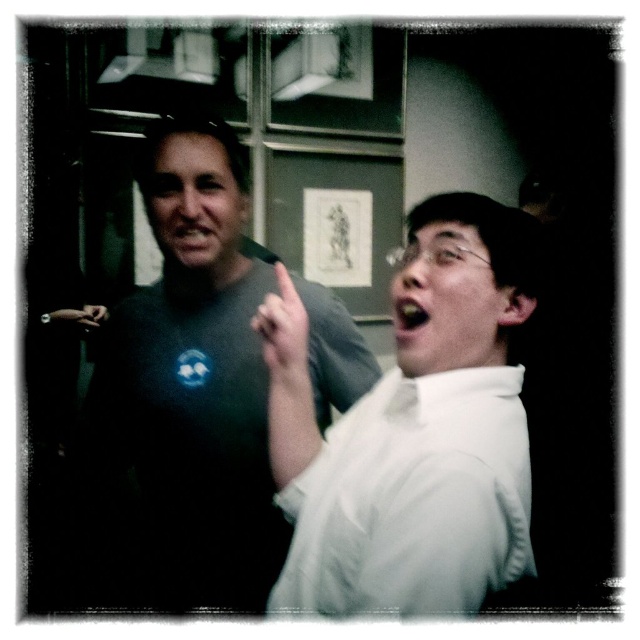
Which is below, white cotton shirt at right or smooth yellowish mouth at center?

Positioned lower is white cotton shirt at right.

Between white cotton shirt at right and smooth yellowish mouth at center, which one appears on the right side from the viewer's perspective?

smooth yellowish mouth at center is more to the right.

Is point (403, 516) farther from viewer compared to point (404, 330)?

No, (403, 516) is closer to viewer.

Locate an element on the screen. The height and width of the screenshot is (640, 640). white cotton shirt at right is located at coordinates (412, 500).

Which is in front, point (396, 429) or point (83, 320)?

Point (396, 429)

Does white cotton shirt at right lie behind matte black hand at upper left?

No, it is in front of matte black hand at upper left.

Which is in front, point (440, 428) or point (80, 321)?

Positioned in front is point (440, 428).

Identify the location of white cotton shirt at right. This screenshot has width=640, height=640. (412, 500).

This screenshot has width=640, height=640. In order to click on dark gray t-shirt at upper left in this screenshot , I will do `click(193, 376)`.

Which is more to the left, dark gray t-shirt at upper left or white matte finger at center?

From the viewer's perspective, dark gray t-shirt at upper left appears more on the left side.

What are the coordinates of `dark gray t-shirt at upper left` in the screenshot? It's located at [193, 376].

What are the coordinates of `dark gray t-shirt at upper left` in the screenshot? It's located at (193, 376).